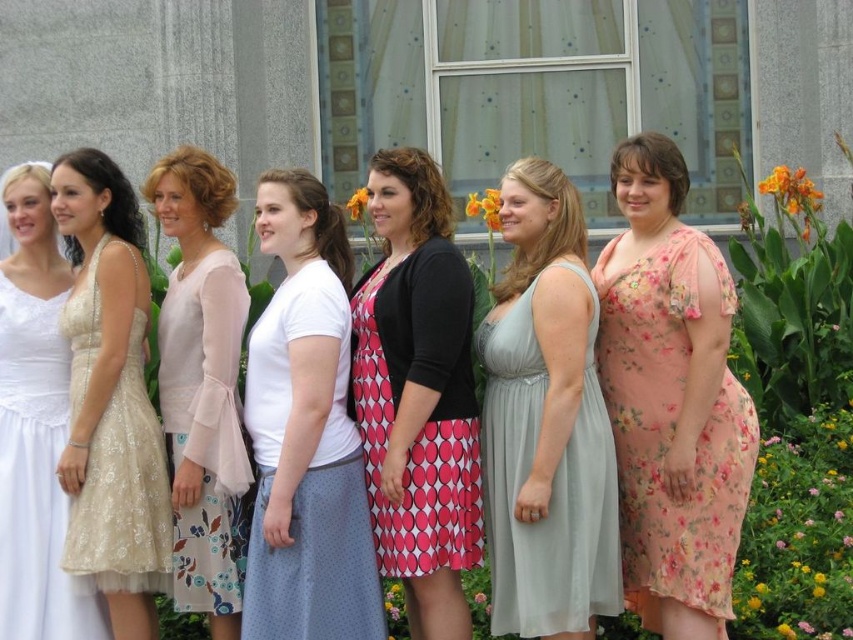
Does point (305, 248) come behind point (117, 224)?

No, (305, 248) is in front of (117, 224).

Identify the location of white matte shirt at center. (305, 433).

Is point (265, 564) positioned after point (141, 224)?

That is False.

You are a GUI agent. You are given a task and a screenshot of the screen. Output one action in this format:
    pyautogui.click(x=<x>, y=<y>)
    Task: Click on the white matte shirt at center
    This screenshot has width=853, height=640.
    Given the screenshot: What is the action you would take?
    pyautogui.click(x=305, y=433)

Can you confirm if yellow fabric flower at center is positioned to the left of orange fabric flower at center?

No, yellow fabric flower at center is not to the left of orange fabric flower at center.

Is point (485, 193) more distant than point (473, 600)?

That is True.

Locate an element on the screen. This screenshot has height=640, width=853. yellow fabric flower at center is located at coordinates (485, 208).

Which is more to the left, pink dotted dress at center or orange fabric flower at upper center?

From the viewer's perspective, orange fabric flower at upper center appears more on the left side.

Is pink dotted dress at center wider than orange fabric flower at upper center?

Yes, pink dotted dress at center is wider than orange fabric flower at upper center.

Is point (397, 212) more distant than point (347, 205)?

No, (397, 212) is in front of (347, 205).

In order to click on pink dotted dress at center in this screenshot , I will do `click(418, 394)`.